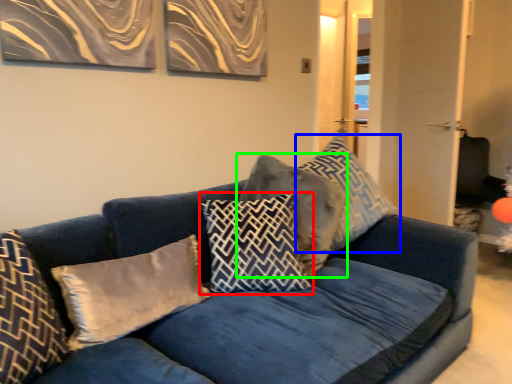
Question: Based on their relative distances, which object is nearer to pillow (highlighted by a red box)? Choose from pillow (highlighted by a blue box) and pillow (highlighted by a green box).

Choices:
 (A) pillow
 (B) pillow

Answer: (B)